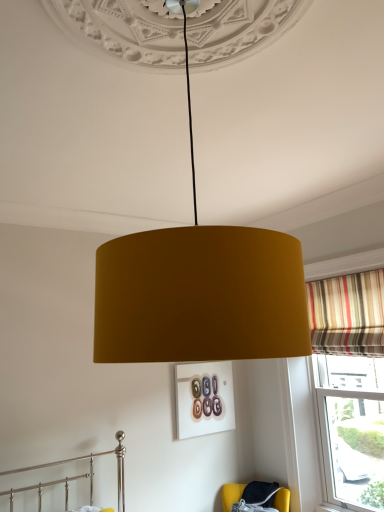
What is the approximate width of striped fabric curtain at right?

striped fabric curtain at right is 15.28 centimeters wide.

Image resolution: width=384 pixels, height=512 pixels. What are the coordinates of `mustard fabric lampshade at center` in the screenshot? It's located at (200, 292).

Locate an element on the screen. The width and height of the screenshot is (384, 512). striped fabric curtain at right is located at coordinates (347, 314).

Would you say striped fabric curtain at right is to the left or to the right of velvet yellow armchair at lower right in the picture?

Clearly, striped fabric curtain at right is on the right of velvet yellow armchair at lower right in the image.

Which of these two, striped fabric curtain at right or velvet yellow armchair at lower right, is wider?

velvet yellow armchair at lower right is wider.

Identify the location of curtain in front of the velvet yellow armchair at lower right. This screenshot has width=384, height=512. (347, 314).

Does point (351, 275) lie in front of point (282, 495)?

Yes.

Could velvet yellow armchair at lower right be considered to be inside mustard fabric lampshade at center?

Actually, velvet yellow armchair at lower right is outside mustard fabric lampshade at center.

Can you confirm if mustard fabric lampshade at center is shorter than velvet yellow armchair at lower right?

No, mustard fabric lampshade at center is not shorter than velvet yellow armchair at lower right.

Is mustard fabric lampshade at center aimed at velvet yellow armchair at lower right?

No, mustard fabric lampshade at center is not turned towards velvet yellow armchair at lower right.

Which is closer, (x=134, y=249) or (x=227, y=493)?

Point (x=134, y=249).

Which object is positioned more to the left, mustard fabric lampshade at center or striped fabric curtain at right?

mustard fabric lampshade at center is more to the left.

Is mustard fabric lampshade at center spatially inside striped fabric curtain at right, or outside of it?

Answer: mustard fabric lampshade at center is spatially situated outside striped fabric curtain at right.

Which point is more forward, (235, 357) or (311, 331)?

The point (235, 357) is in front.

Considering the positions of objects velvet yellow armchair at lower right and striped fabric curtain at right in the image provided, who is more to the left, velvet yellow armchair at lower right or striped fabric curtain at right?

velvet yellow armchair at lower right.

Is velvet yellow armchair at lower right facing away from striped fabric curtain at right?

No, velvet yellow armchair at lower right's orientation is not away from striped fabric curtain at right.

Which of these two, velvet yellow armchair at lower right or striped fabric curtain at right, is smaller?

striped fabric curtain at right.

Looking at their sizes, would you say velvet yellow armchair at lower right is wider or thinner than striped fabric curtain at right?

In the image, velvet yellow armchair at lower right appears to be wider than striped fabric curtain at right.

From the image's perspective, which one is positioned lower, velvet yellow armchair at lower right or mustard fabric lampshade at center?

velvet yellow armchair at lower right appears lower in the image.

In terms of width, does velvet yellow armchair at lower right look wider or thinner when compared to mustard fabric lampshade at center?

In the image, velvet yellow armchair at lower right appears to be more narrow than mustard fabric lampshade at center.

Considering the positions of objects velvet yellow armchair at lower right and mustard fabric lampshade at center in the image provided, who is behind, velvet yellow armchair at lower right or mustard fabric lampshade at center?

velvet yellow armchair at lower right is more distant.

Are velvet yellow armchair at lower right and mustard fabric lampshade at center making contact?

No, velvet yellow armchair at lower right is not with mustard fabric lampshade at center.

How many degrees apart are the facing directions of striped fabric curtain at right and mustard fabric lampshade at center?

The angular difference between striped fabric curtain at right and mustard fabric lampshade at center is 4.93 degrees.

Is striped fabric curtain at right to the left or to the right of mustard fabric lampshade at center in the image?

Clearly, striped fabric curtain at right is on the right of mustard fabric lampshade at center in the image.

How distant is striped fabric curtain at right from mustard fabric lampshade at center?

striped fabric curtain at right and mustard fabric lampshade at center are 8.63 feet apart from each other.

Is striped fabric curtain at right far from mustard fabric lampshade at center?

Indeed, striped fabric curtain at right is not near mustard fabric lampshade at center.

The image size is (384, 512). In the image, there is a velvet yellow armchair at lower right. What are the coordinates of `curtain above it (from the image's perspective)` in the screenshot? It's located at (347, 314).

This screenshot has height=512, width=384. I want to click on lamp lying in front of the velvet yellow armchair at lower right, so click(x=200, y=292).

Looking at this image, which object lies nearer to the anchor point mustard fabric lampshade at center, velvet yellow armchair at lower right or striped fabric curtain at right?

The object closer to mustard fabric lampshade at center is striped fabric curtain at right.

Which object lies nearer to the anchor point mustard fabric lampshade at center, striped fabric curtain at right or velvet yellow armchair at lower right?

striped fabric curtain at right is closer to mustard fabric lampshade at center.

Looking at the image, which one is located further to velvet yellow armchair at lower right, mustard fabric lampshade at center or striped fabric curtain at right?

mustard fabric lampshade at center is positioned further to the anchor velvet yellow armchair at lower right.

Which object lies further to the anchor point striped fabric curtain at right, velvet yellow armchair at lower right or mustard fabric lampshade at center?

Among the two, mustard fabric lampshade at center is located further to striped fabric curtain at right.

From the image, which object appears to be farther from striped fabric curtain at right, mustard fabric lampshade at center or velvet yellow armchair at lower right?

Among the two, mustard fabric lampshade at center is located further to striped fabric curtain at right.

When comparing their distances from velvet yellow armchair at lower right, does striped fabric curtain at right or mustard fabric lampshade at center seem closer?

striped fabric curtain at right is positioned closer to the anchor velvet yellow armchair at lower right.

The width and height of the screenshot is (384, 512). Identify the location of curtain located between mustard fabric lampshade at center and velvet yellow armchair at lower right in the depth direction. (347, 314).